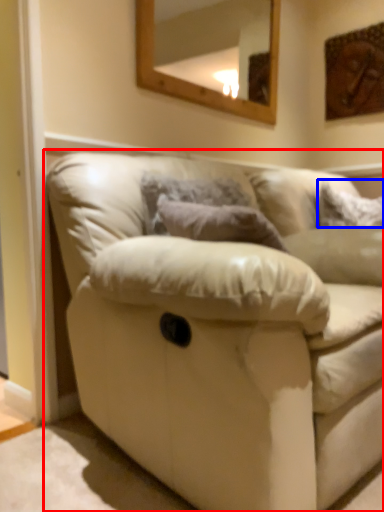
Question: Which of the following is the closest to the observer, studio couch (highlighted by a red box) or pillow (highlighted by a blue box)?

Choices:
 (A) studio couch
 (B) pillow

Answer: (A)